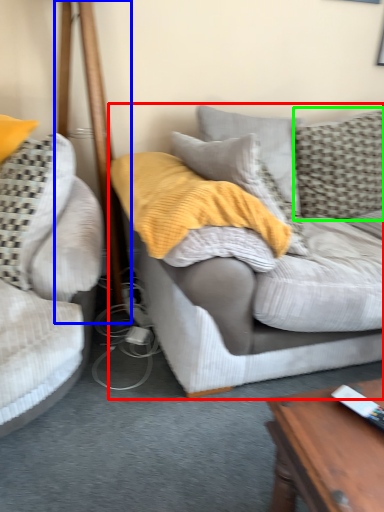
Question: Which object is the farthest from studio couch (highlighted by a red box)? Choose among these: pole (highlighted by a blue box) or pillow (highlighted by a green box).

Choices:
 (A) pole
 (B) pillow

Answer: (A)